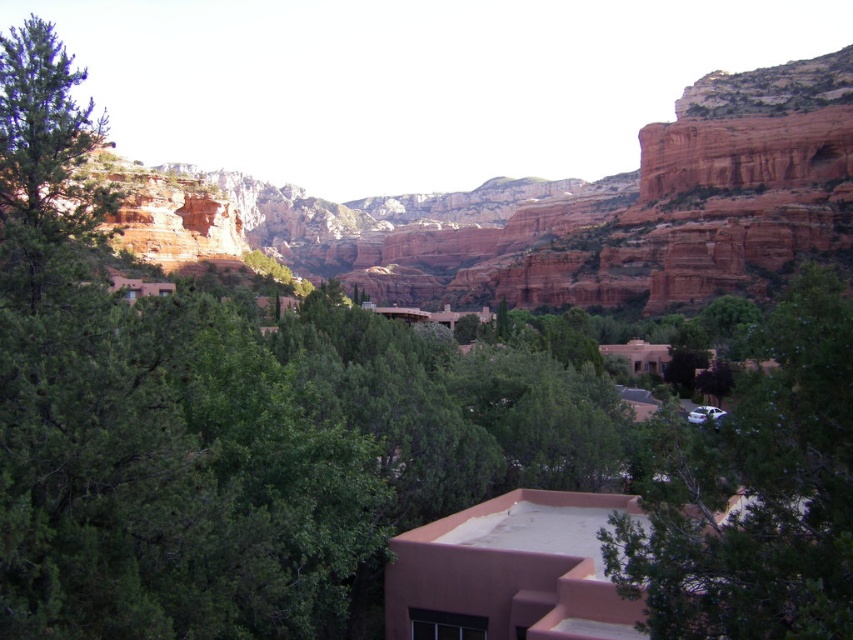
Question: Can you confirm if green leafy tree at center is smaller than green matte tree at left?

Choices:
 (A) yes
 (B) no

Answer: (A)

Question: Does rustic rock formation at center appear on the left side of green leafy tree at center?

Choices:
 (A) no
 (B) yes

Answer: (B)

Question: Does rustic rock formation at center appear on the right side of green leafy tree at center?

Choices:
 (A) yes
 (B) no

Answer: (B)

Question: Among these points, which one is farthest from the camera?

Choices:
 (A) (802, 304)
 (B) (85, 188)
 (C) (804, 147)

Answer: (C)

Question: Which of these objects is positioned closest to the green matte tree at left?

Choices:
 (A) green leafy tree at center
 (B) rustic rock formation at center

Answer: (A)

Question: Which point is farther from the camera taking this photo?

Choices:
 (A) (808, 448)
 (B) (22, 298)
 (C) (502, 225)

Answer: (C)